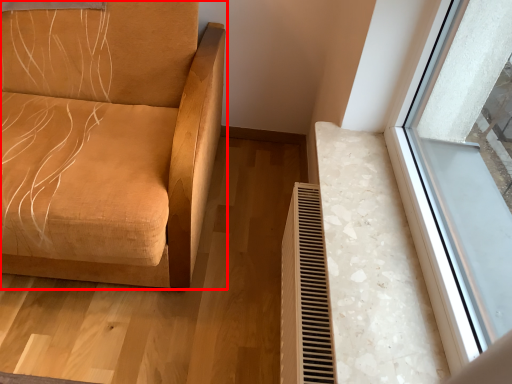
Question: From the image's perspective, what is the correct spatial positioning of furniture (annotated by the red box) in reference to radiator?

Choices:
 (A) below
 (B) above

Answer: (B)